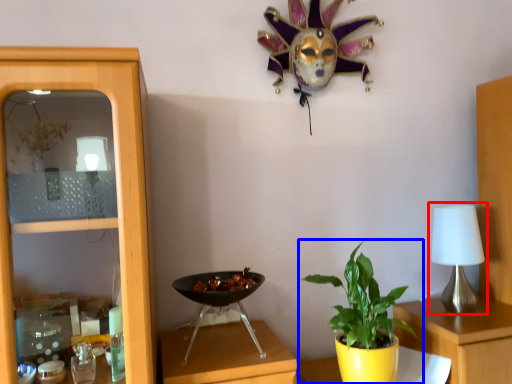
Question: Which of the following is the closest to the observer, table lamp (highlighted by a red box) or houseplant (highlighted by a blue box)?

Choices:
 (A) table lamp
 (B) houseplant

Answer: (B)